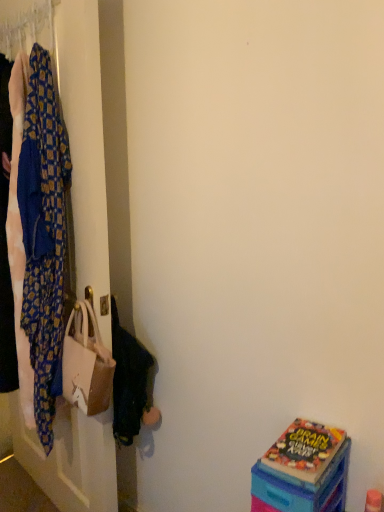
Question: Is beige fabric handbag at left oriented away from blue patterned fabric at left?

Choices:
 (A) no
 (B) yes

Answer: (A)

Question: Does beige fabric handbag at left appear on the left side of blue patterned fabric at left?

Choices:
 (A) yes
 (B) no

Answer: (B)

Question: Is beige fabric handbag at left to the right of blue patterned fabric at left from the viewer's perspective?

Choices:
 (A) no
 (B) yes

Answer: (B)

Question: Is beige fabric handbag at left taller than blue patterned fabric at left?

Choices:
 (A) no
 (B) yes

Answer: (A)

Question: From a real-world perspective, does beige fabric handbag at left sit lower than blue patterned fabric at left?

Choices:
 (A) yes
 (B) no

Answer: (A)

Question: Is beige fabric handbag at left shorter than blue patterned fabric at left?

Choices:
 (A) no
 (B) yes

Answer: (B)

Question: From a real-world perspective, is patterned fabric at left over beige fabric handbag at left?

Choices:
 (A) no
 (B) yes

Answer: (B)

Question: Is patterned fabric at left wider than beige fabric handbag at left?

Choices:
 (A) no
 (B) yes

Answer: (B)

Question: Is patterned fabric at left positioned in front of beige fabric handbag at left?

Choices:
 (A) no
 (B) yes

Answer: (B)

Question: Does patterned fabric at left have a lesser height compared to beige fabric handbag at left?

Choices:
 (A) yes
 (B) no

Answer: (B)

Question: Is patterned fabric at left to the left of beige fabric handbag at left from the viewer's perspective?

Choices:
 (A) yes
 (B) no

Answer: (A)

Question: Is beige fabric handbag at left located within patterned fabric at left?

Choices:
 (A) yes
 (B) no

Answer: (A)

Question: Is beige fabric handbag at left aimed at matte plastic box at lower right?

Choices:
 (A) no
 (B) yes

Answer: (A)